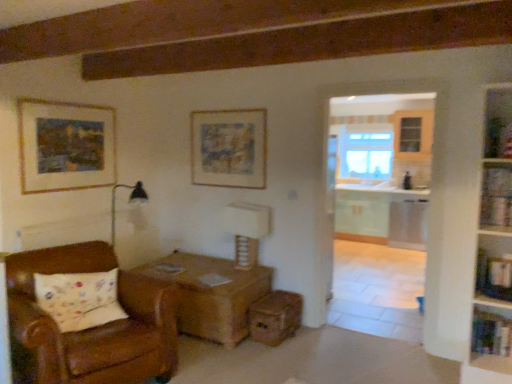
Question: Is matte paper picture frame at upper center, which ranks as the second picture frame in left-to-right order, to the left of white textured table lamp at center from the viewer's perspective?

Choices:
 (A) no
 (B) yes

Answer: (B)

Question: Is matte paper picture frame at upper center, the first picture frame viewed from the right, to the right of white textured table lamp at center from the viewer's perspective?

Choices:
 (A) yes
 (B) no

Answer: (B)

Question: Is matte paper picture frame at upper center, the first picture frame viewed from the right, not inside white textured table lamp at center?

Choices:
 (A) no
 (B) yes

Answer: (B)

Question: Is matte paper picture frame at upper center, the first picture frame viewed from the right, surrounding white textured table lamp at center?

Choices:
 (A) no
 (B) yes

Answer: (A)

Question: From a real-world perspective, is matte paper picture frame at upper center, the first picture frame viewed from the right, on top of white textured table lamp at center?

Choices:
 (A) no
 (B) yes

Answer: (B)

Question: Considering the positions of brown leather chair at lower left and wooden bookshelf at right, the 2th shelf when ordered from bottom to top, in the image, is brown leather chair at lower left taller or shorter than wooden bookshelf at right, the 2th shelf when ordered from bottom to top,?

Choices:
 (A) short
 (B) tall

Answer: (B)

Question: From a real-world perspective, is brown leather chair at lower left above or below wooden bookshelf at right, the 2th shelf when ordered from bottom to top?

Choices:
 (A) below
 (B) above

Answer: (A)

Question: Is brown leather chair at lower left inside or outside of wooden bookshelf at right, marked as the second shelf in a top-to-bottom arrangement?

Choices:
 (A) outside
 (B) inside

Answer: (A)

Question: Would you say brown leather chair at lower left is to the left or to the right of wooden bookshelf at right, marked as the second shelf in a top-to-bottom arrangement, in the picture?

Choices:
 (A) left
 (B) right

Answer: (A)

Question: Considering the positions of point [x=264, y=321] and point [x=250, y=225], is point [x=264, y=321] closer or farther from the camera than point [x=250, y=225]?

Choices:
 (A) farther
 (B) closer

Answer: (B)

Question: Is wooden drawer at lower center inside or outside of white textured table lamp at center?

Choices:
 (A) inside
 (B) outside

Answer: (B)

Question: From the image's perspective, is wooden drawer at lower center positioned above or below white textured table lamp at center?

Choices:
 (A) below
 (B) above

Answer: (A)

Question: In the image, is wooden drawer at lower center positioned in front of or behind white textured table lamp at center?

Choices:
 (A) behind
 (B) front

Answer: (B)

Question: Is clear glass window at center wider or thinner than white textured table lamp at center?

Choices:
 (A) wide
 (B) thin

Answer: (A)

Question: Is clear glass window at center taller or shorter than white textured table lamp at center?

Choices:
 (A) short
 (B) tall

Answer: (B)